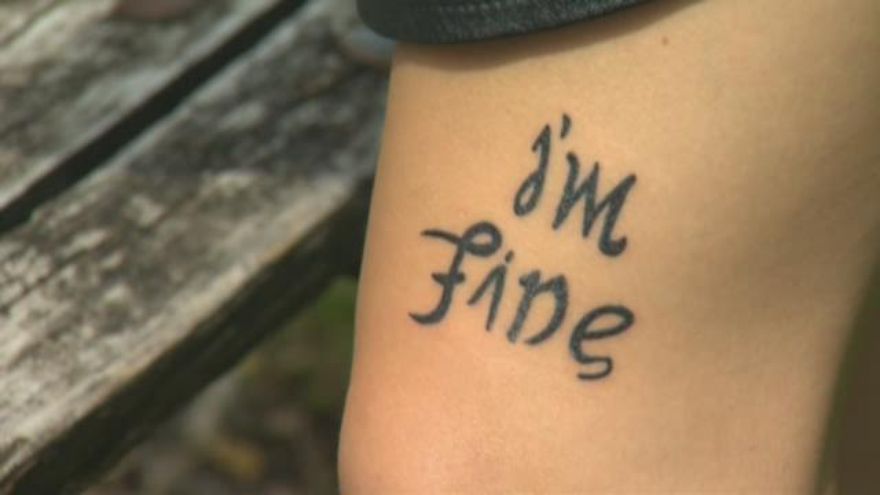
The width and height of the screenshot is (880, 495). I want to click on faded wood, so click(118, 286).